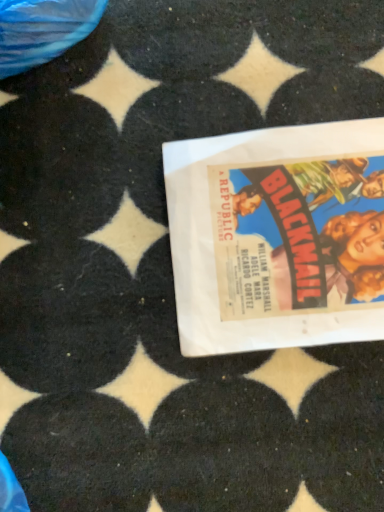
Locate an element on the screen. Image resolution: width=384 pixels, height=512 pixels. vacant region above matte paper poster at center (from a real-world perspective) is located at coordinates (289, 237).